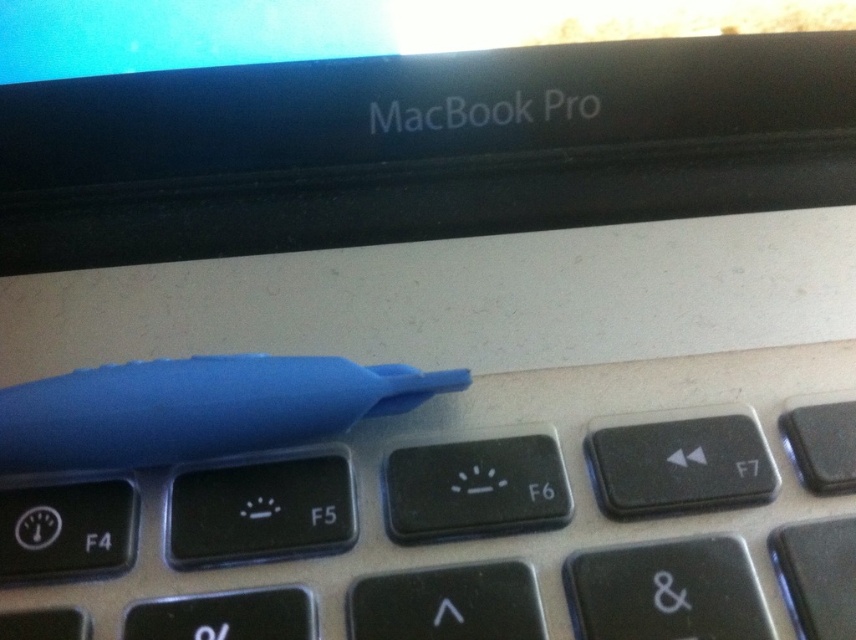
Between blue rubber pen at upper center and blue rubber pen at center, which one appears on the left side from the viewer's perspective?

blue rubber pen at center is more to the left.

You are a GUI agent. You are given a task and a screenshot of the screen. Output one action in this format:
    pyautogui.click(x=<x>, y=<y>)
    Task: Click on the blue rubber pen at upper center
    
    Given the screenshot: What is the action you would take?
    pyautogui.click(x=568, y=470)

Locate an element on the screen. The height and width of the screenshot is (640, 856). blue rubber pen at upper center is located at coordinates (568, 470).